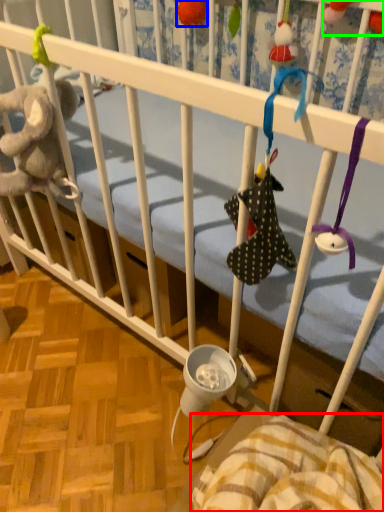
Question: Which is farther away from blanket (highlighted by a red box)? toy (highlighted by a blue box) or toy (highlighted by a green box)?

Choices:
 (A) toy
 (B) toy

Answer: (A)